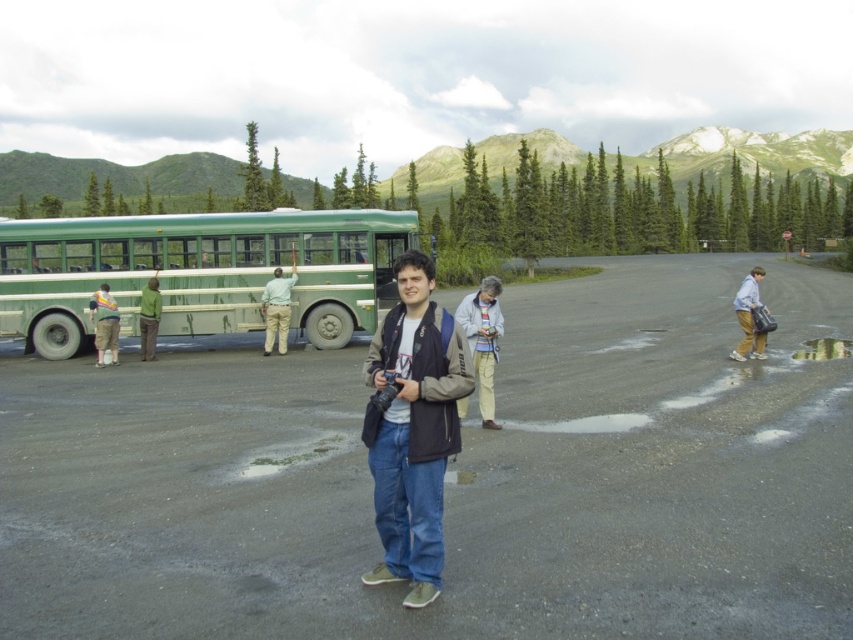
Can you confirm if light gray fabric jacket at center is shorter than green matte shirt at left?

Correct, light gray fabric jacket at center is not as tall as green matte shirt at left.

Between point (467, 332) and point (279, 289), which one is positioned in front?

Point (467, 332) is more forward.

What are the coordinates of `light gray fabric jacket at center` in the screenshot? It's located at point(483,340).

Is point (129, 460) positioned in front of point (151, 323)?

That is True.

From the picture: Can you confirm if dark asphalt parking lot at center is wider than green fabric pants at left?

Indeed, dark asphalt parking lot at center has a greater width compared to green fabric pants at left.

Between point (91, 516) and point (154, 344), which one is positioned behind?

Point (154, 344)

The height and width of the screenshot is (640, 853). Identify the location of dark asphalt parking lot at center. (451, 477).

Can you confirm if light blue denim jeans at right is thinner than khaki pants at left?

Incorrect, light blue denim jeans at right's width is not less than khaki pants at left's.

Is light blue denim jeans at right wider than khaki pants at left?

Yes.

Identify the location of light blue denim jeans at right. (749, 317).